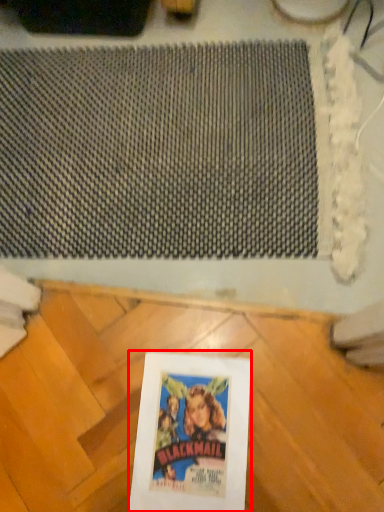
Question: From the image's perspective, where is picture frame (annotated by the red box) located relative to mat?

Choices:
 (A) below
 (B) above

Answer: (A)